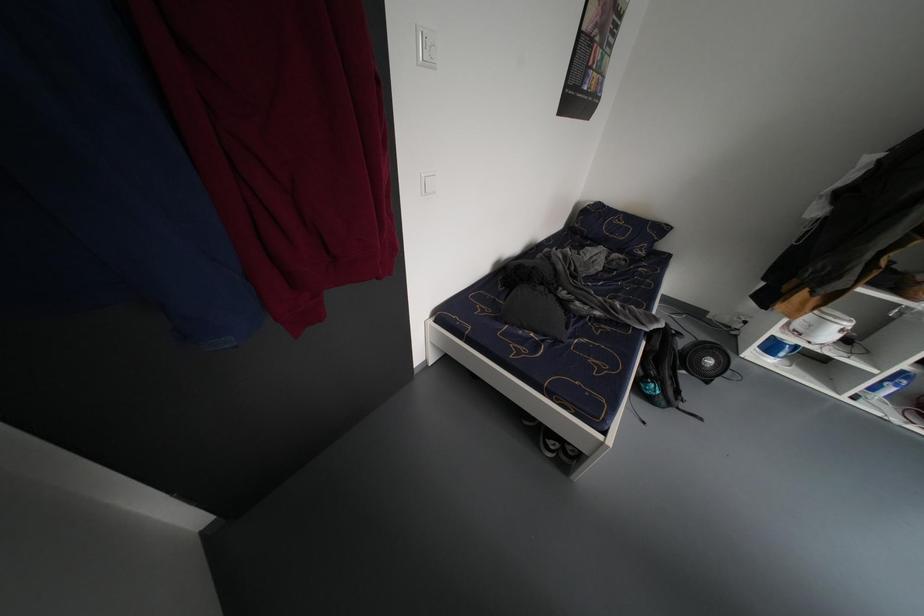
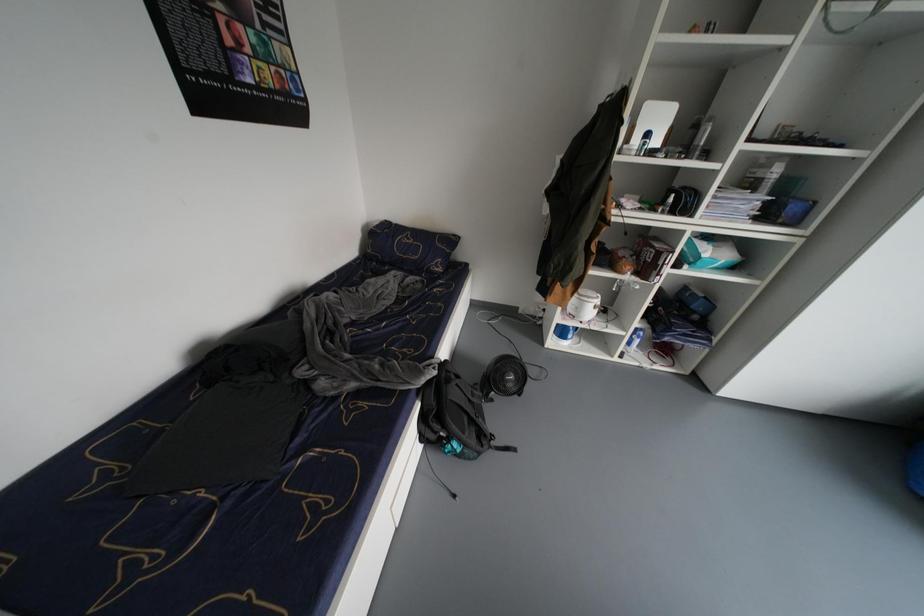
Question: The camera is either moving clockwise (left) or counter-clockwise (right) around the object. The first image is from the beginning of the video and the second image is from the end. Is the camera moving left or right when shooting the video?

Choices:
 (A) Left
 (B) Right

Answer: (A)